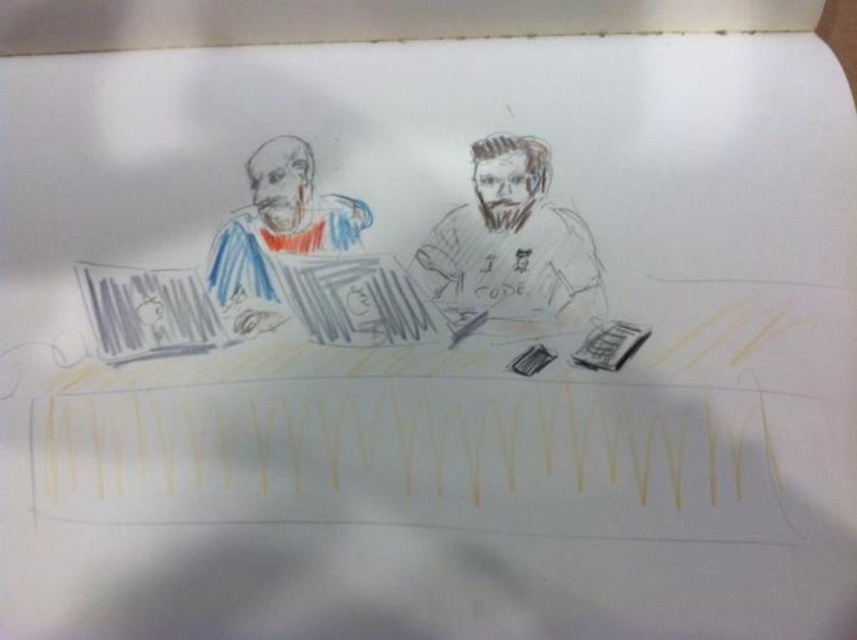
Looking at this image, who is positioned more to the left, gray pencil sketch of man at center or matte blue and red striped shirt at left?

matte blue and red striped shirt at left is more to the left.

Can you confirm if gray pencil sketch of man at center is positioned to the left of matte blue and red striped shirt at left?

Incorrect, gray pencil sketch of man at center is not on the left side of matte blue and red striped shirt at left.

Which is behind, point (430, 243) or point (228, 310)?

The point (430, 243) is more distant.

Find the location of a particular element. The width and height of the screenshot is (857, 640). gray pencil sketch of man at center is located at coordinates (508, 244).